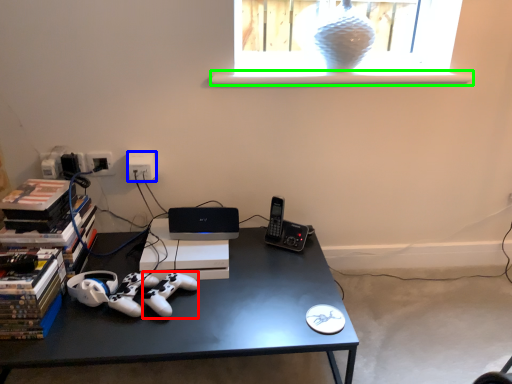
Question: Estimate the real-world distances between objects in this image. Which object is farther from game controller (highlighted by a red box), electric outlet (highlighted by a blue box) or window sill (highlighted by a green box)?

Choices:
 (A) electric outlet
 (B) window sill

Answer: (B)